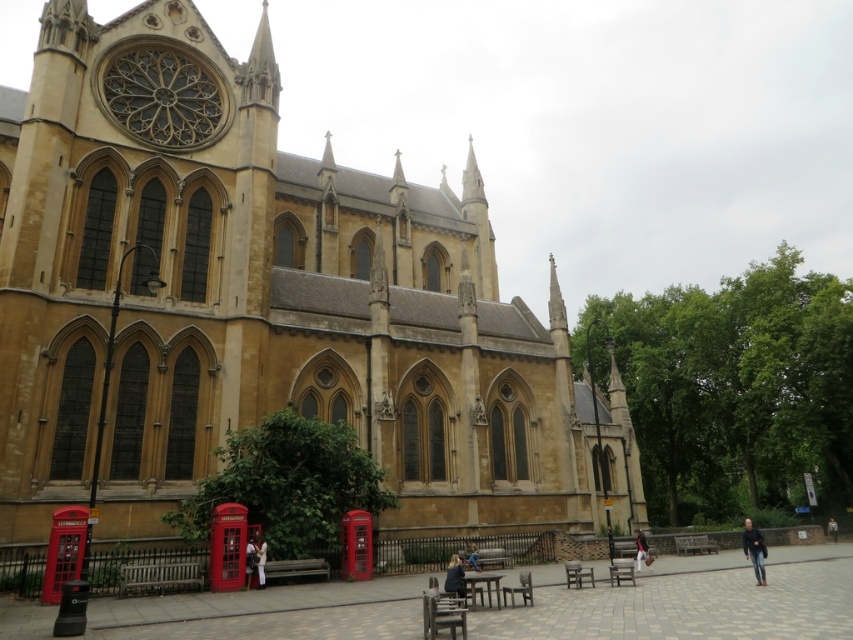
Which is below, golden stone church at center or dark gray fabric jacket at lower right?

dark gray fabric jacket at lower right is lower down.

Does point (253, 116) come farther from viewer compared to point (827, 529)?

No, (253, 116) is closer to viewer.

Find the location of a particular element. golden stone church at center is located at coordinates (260, 301).

Is golden stone church at center closer to the viewer compared to blue denim jeans at lower center?

That is True.

Is golden stone church at center wider than blue denim jeans at lower center?

Yes.

Is point (486, 342) closer to viewer compared to point (479, 568)?

No, it is not.

This screenshot has height=640, width=853. Identify the location of golden stone church at center. (260, 301).

Who is positioned more to the right, light brown wooden bench at lower center or dark gray fabric jacket at lower right?

dark gray fabric jacket at lower right

Image resolution: width=853 pixels, height=640 pixels. Describe the element at coordinates (641, 550) in the screenshot. I see `light brown wooden bench at lower center` at that location.

Where is `light brown wooden bench at lower center`? The image size is (853, 640). light brown wooden bench at lower center is located at coordinates coord(641,550).